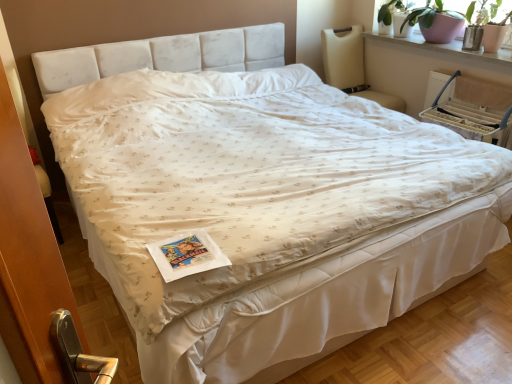
Identify the location of smooth white window sill at upper right. (445, 48).

What do you see at coordinates (351, 66) in the screenshot? The width and height of the screenshot is (512, 384). I see `beige fabric rocking chair at upper right` at bounding box center [351, 66].

You are a GUI agent. You are given a task and a screenshot of the screen. Output one action in this format:
    pyautogui.click(x=<x>, y=<y>)
    Task: Click on the matte pink pot at upper right
    
    Given the screenshot: What is the action you would take?
    pyautogui.click(x=439, y=12)

What are the coordinates of `smooth white window sill at upper right` in the screenshot? It's located at (445, 48).

Consider the image. Which of these two, smooth white window sill at upper right or beige fabric armchair at upper right, stands shorter?

smooth white window sill at upper right is shorter.

From the image's perspective, is smooth white window sill at upper right positioned above or below beige fabric armchair at upper right?

Clearly, from the image's perspective, smooth white window sill at upper right is above beige fabric armchair at upper right.

Is the position of smooth white window sill at upper right less distant than that of beige fabric armchair at upper right?

Yes, smooth white window sill at upper right is closer to the camera.

Image resolution: width=512 pixels, height=384 pixels. Find the location of `window sill lying in front of the beige fabric armchair at upper right`. window sill lying in front of the beige fabric armchair at upper right is located at coordinates (445, 48).

Is beige fabric armchair at upper right thinner than smooth white window sill at upper right?

Yes.

You are a GUI agent. You are given a task and a screenshot of the screen. Output one action in this format:
    pyautogui.click(x=<x>, y=<y>)
    Task: Click on the window sill that appears in front of the beige fabric armchair at upper right
    
    Given the screenshot: What is the action you would take?
    pyautogui.click(x=445, y=48)

From a real-world perspective, which is physically below, beige fabric armchair at upper right or smooth white window sill at upper right?

beige fabric armchair at upper right.

Who is taller, beige fabric armchair at upper right or smooth white window sill at upper right?

beige fabric armchair at upper right is taller.

Does point (478, 105) lie in front of point (361, 45)?

Yes, it is in front of point (361, 45).

Looking at their sizes, would you say beige fabric armchair at upper right is wider or thinner than beige fabric rocking chair at upper right?

beige fabric armchair at upper right is thinner than beige fabric rocking chair at upper right.

From the image's perspective, between beige fabric rocking chair at upper right and smooth white window sill at upper right, which one is located above?

Answer: smooth white window sill at upper right appears higher in the image.

Is beige fabric rocking chair at upper right completely or partially outside of smooth white window sill at upper right?

Indeed, beige fabric rocking chair at upper right is completely outside smooth white window sill at upper right.

How much distance is there between beige fabric rocking chair at upper right and smooth white window sill at upper right?

beige fabric rocking chair at upper right is 38.20 centimeters away from smooth white window sill at upper right.

From a real-world perspective, which is physically above, beige fabric rocking chair at upper right or smooth white window sill at upper right?

From a 3D spatial view, smooth white window sill at upper right is above.

How far apart are matte pink pot at upper right and beige fabric armchair at upper right?

A distance of 18.65 inches exists between matte pink pot at upper right and beige fabric armchair at upper right.

From the picture: From a real-world perspective, is matte pink pot at upper right beneath beige fabric armchair at upper right?

No, from a real-world perspective, matte pink pot at upper right is not under beige fabric armchair at upper right.

Does matte pink pot at upper right have a smaller size compared to beige fabric armchair at upper right?

Actually, matte pink pot at upper right might be larger than beige fabric armchair at upper right.

Consider the image. Is matte pink pot at upper right not inside beige fabric armchair at upper right?

Absolutely, matte pink pot at upper right is external to beige fabric armchair at upper right.

In the image, is beige fabric rocking chair at upper right positioned in front of or behind matte pink pot at upper right?

beige fabric rocking chair at upper right is positioned farther from the viewer than matte pink pot at upper right.

Who is taller, beige fabric rocking chair at upper right or matte pink pot at upper right?

Standing taller between the two is beige fabric rocking chair at upper right.

Between beige fabric rocking chair at upper right and matte pink pot at upper right, which one appears on the right side from the viewer's perspective?

From the viewer's perspective, matte pink pot at upper right appears more on the right side.

From a real-world perspective, is beige fabric armchair at upper right positioned under matte pink pot at upper right based on gravity?

Correct, in the physical world, beige fabric armchair at upper right is lower than matte pink pot at upper right.

Which point is more distant from viewer, (429, 110) or (424, 8)?

The point (429, 110) is farther.

From the image's perspective, between beige fabric armchair at upper right and matte pink pot at upper right, who is located below?

beige fabric armchair at upper right, from the image's perspective.

At what (x,y) coordinates should I click in order to perform the action: click on plant above the beige fabric armchair at upper right (from a real-world perspective). Please return your answer as a coordinate pair (x, y). Looking at the image, I should click on (439, 12).

Where is `armchair below the smooth white window sill at upper right (from a real-world perspective)`? The height and width of the screenshot is (384, 512). armchair below the smooth white window sill at upper right (from a real-world perspective) is located at coordinates (474, 110).

This screenshot has width=512, height=384. Find the location of `window sill on the left of the beige fabric armchair at upper right`. window sill on the left of the beige fabric armchair at upper right is located at coordinates (445, 48).

Considering their positions, is beige fabric rocking chair at upper right positioned closer to matte pink pot at upper right than beige fabric armchair at upper right?

The object closer to matte pink pot at upper right is beige fabric armchair at upper right.

Looking at the image, which one is located closer to matte pink pot at upper right, beige fabric rocking chair at upper right or smooth white window sill at upper right?

The object closer to matte pink pot at upper right is smooth white window sill at upper right.

Considering their positions, is beige fabric rocking chair at upper right positioned closer to beige fabric armchair at upper right than matte pink pot at upper right?

matte pink pot at upper right lies closer to beige fabric armchair at upper right than the other object.

Looking at the image, which one is located closer to matte pink pot at upper right, beige fabric armchair at upper right or smooth white window sill at upper right?

The object closer to matte pink pot at upper right is smooth white window sill at upper right.

Looking at the image, which one is located further to beige fabric armchair at upper right, smooth white window sill at upper right or matte pink pot at upper right?

Among the two, matte pink pot at upper right is located further to beige fabric armchair at upper right.

Looking at the image, which one is located closer to beige fabric rocking chair at upper right, matte pink pot at upper right or smooth white window sill at upper right?

smooth white window sill at upper right is closer to beige fabric rocking chair at upper right.

In the scene shown: When comparing their distances from beige fabric armchair at upper right, does smooth white window sill at upper right or beige fabric rocking chair at upper right seem closer?

smooth white window sill at upper right is positioned closer to the anchor beige fabric armchair at upper right.

Considering their positions, is beige fabric armchair at upper right positioned further to beige fabric rocking chair at upper right than matte pink pot at upper right?

The object further to beige fabric rocking chair at upper right is beige fabric armchair at upper right.

This screenshot has height=384, width=512. Find the location of `window sill between beige fabric rocking chair at upper right and beige fabric armchair at upper right in the horizontal direction`. window sill between beige fabric rocking chair at upper right and beige fabric armchair at upper right in the horizontal direction is located at coordinates pyautogui.click(x=445, y=48).

Identify the location of plant between beige fabric rocking chair at upper right and smooth white window sill at upper right from left to right. (439, 12).

Locate an element on the screen. The width and height of the screenshot is (512, 384). rocking chair between matte pink pot at upper right and beige fabric armchair at upper right in the up-down direction is located at coordinates (351, 66).

I want to click on window sill that lies between matte pink pot at upper right and beige fabric armchair at upper right from top to bottom, so click(445, 48).